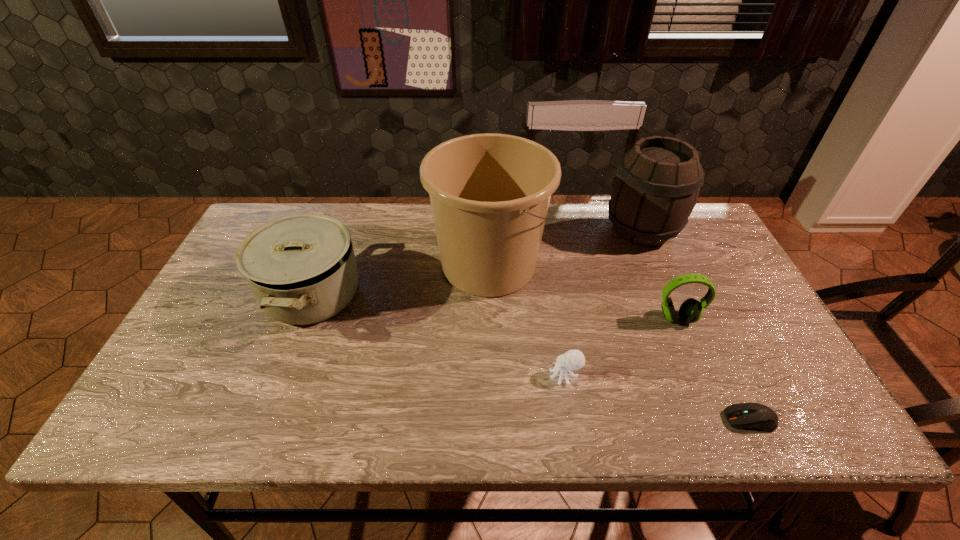
The height and width of the screenshot is (540, 960). Identify the location of the tallest object. (489, 193).

The width and height of the screenshot is (960, 540). Identify the location of the second tallest object. (657, 182).

Locate an element on the screen. saucepan is located at coordinates (302, 269).

At what (x,y) coordinates should I click in order to perform the action: click on the fourth shortest object. Please return your answer as a coordinate pair (x, y). This screenshot has height=540, width=960. Looking at the image, I should click on tap(302, 269).

At what (x,y) coordinates should I click in order to perform the action: click on the third shortest object. Please return your answer as a coordinate pair (x, y). Looking at the image, I should click on (691, 310).

Where is `the fifth farthest object`? This screenshot has width=960, height=540. the fifth farthest object is located at coordinates (573, 359).

Locate an element on the screen. octopus is located at coordinates (573, 359).

The image size is (960, 540). Identify the location of computer equipment. (757, 416).

Find the location of a particular element. the shortest object is located at coordinates (757, 416).

Identify the location of vacant space located on the left of the bucket. (389, 265).